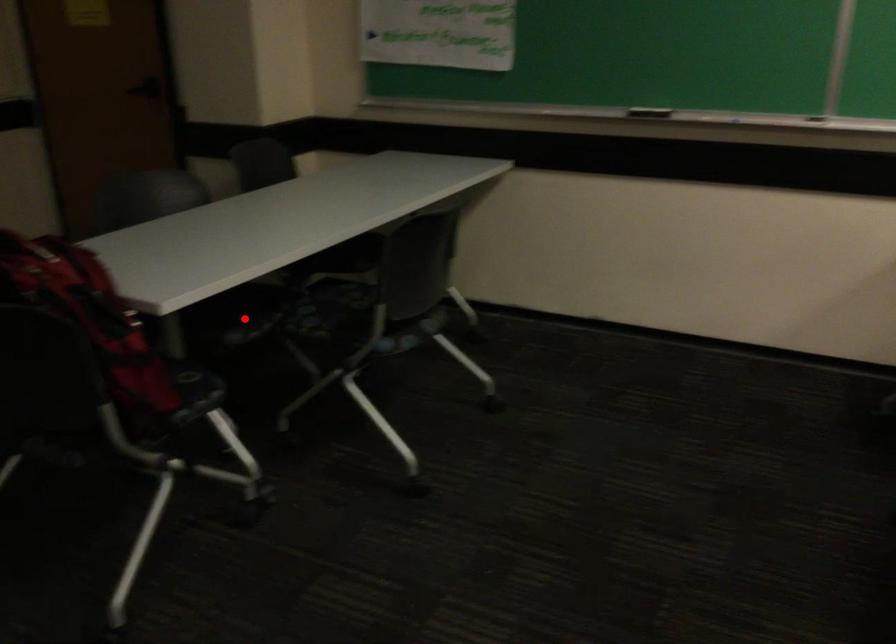
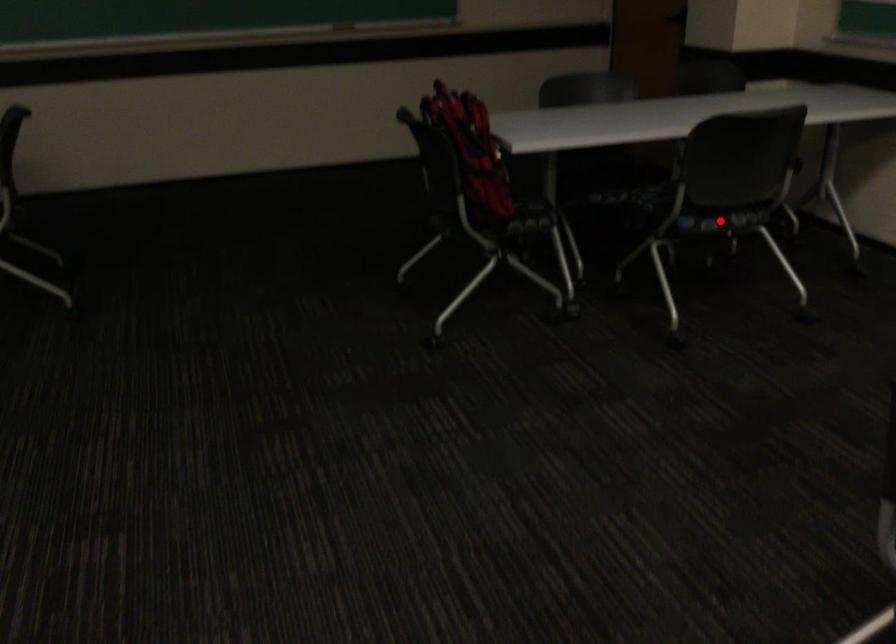
I am providing you with two images of the same scene from different viewpoints. A red point is marked on the first image and another point is marked on the second image. Is the red point in image1 aligned with the point shown in image2?

No